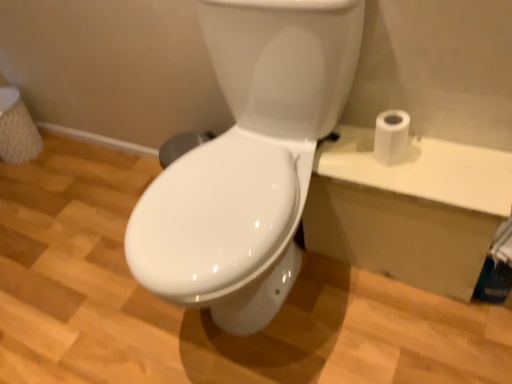
Question: From a real-world perspective, is white glossy toilet at center located beneath white matte toilet paper at right?

Choices:
 (A) no
 (B) yes

Answer: (B)

Question: Does white glossy toilet at center touch white matte toilet paper at right?

Choices:
 (A) no
 (B) yes

Answer: (A)

Question: Considering the relative sizes of white glossy toilet at center and white matte toilet paper at right in the image provided, is white glossy toilet at center smaller than white matte toilet paper at right?

Choices:
 (A) yes
 (B) no

Answer: (B)

Question: Can you confirm if white glossy toilet at center is wider than white matte toilet paper at right?

Choices:
 (A) no
 (B) yes

Answer: (B)

Question: Can white matte toilet paper at right be found inside white glossy toilet at center?

Choices:
 (A) no
 (B) yes

Answer: (A)

Question: Could you tell me if white glossy toilet at center is facing white matte toilet paper at right?

Choices:
 (A) no
 (B) yes

Answer: (A)

Question: Does white matte toilet paper at right have a larger size compared to white glossy toilet at center?

Choices:
 (A) no
 (B) yes

Answer: (A)

Question: From a real-world perspective, is white matte toilet paper at right over white glossy toilet at center?

Choices:
 (A) no
 (B) yes

Answer: (B)

Question: Does white matte toilet paper at right have a smaller size compared to white glossy toilet at center?

Choices:
 (A) yes
 (B) no

Answer: (A)

Question: Is white matte toilet paper at right positioned beyond the bounds of white glossy toilet at center?

Choices:
 (A) yes
 (B) no

Answer: (A)

Question: Does white matte toilet paper at right touch white glossy toilet at center?

Choices:
 (A) yes
 (B) no

Answer: (B)

Question: Is white matte toilet paper at right shorter than white glossy toilet at center?

Choices:
 (A) yes
 (B) no

Answer: (A)

Question: Considering the positions of white glossy toilet at center and white matte toilet paper at right in the image, is white glossy toilet at center bigger or smaller than white matte toilet paper at right?

Choices:
 (A) small
 (B) big

Answer: (B)